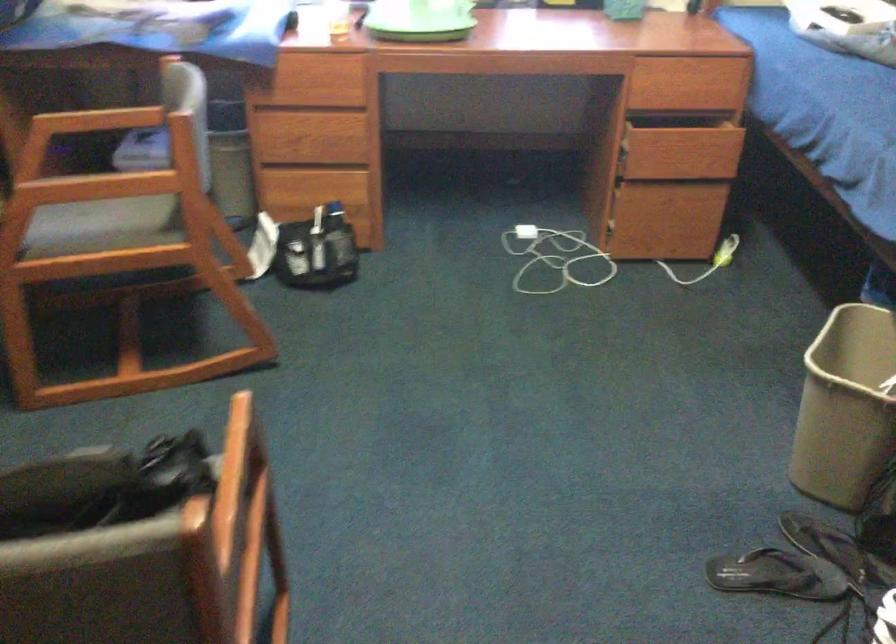
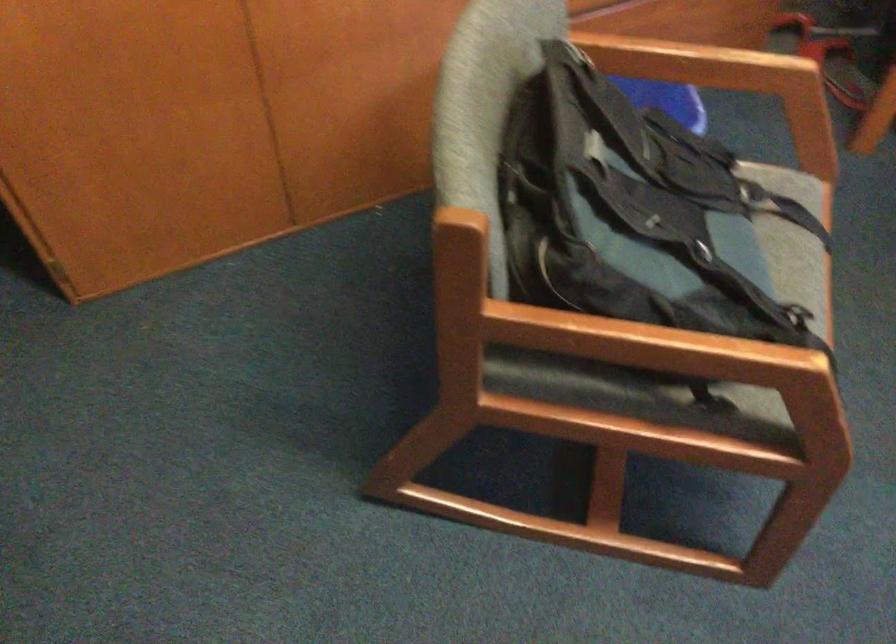
The images are taken continuously from a first-person perspective. In which direction is your viewpoint rotating?

The camera rotated toward left-down.